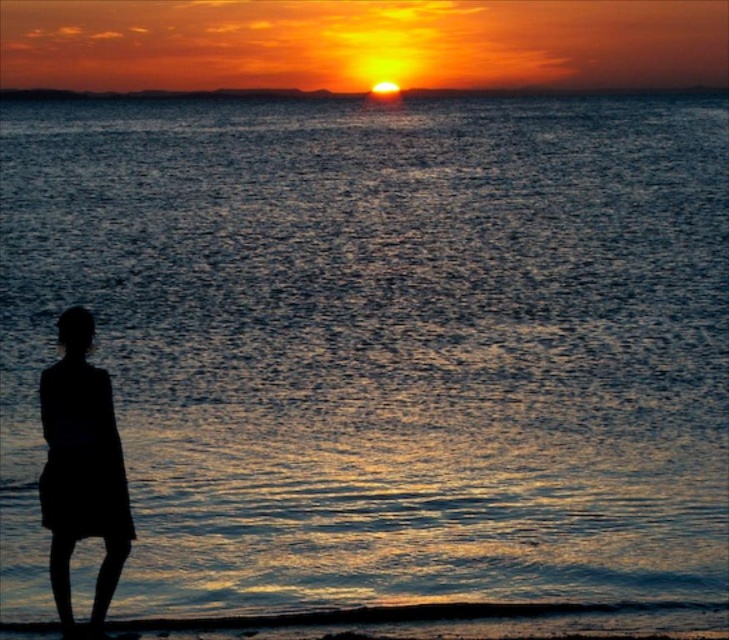
Question: Which of the following is the farthest from the observer?

Choices:
 (A) smooth orange sky at center
 (B) silhouette dress at left

Answer: (A)

Question: Does silhouette dress at left have a lesser width compared to smooth orange sky at center?

Choices:
 (A) no
 (B) yes

Answer: (B)

Question: Does silhouette dress at left have a lesser width compared to smooth orange sky at center?

Choices:
 (A) no
 (B) yes

Answer: (B)

Question: Which of the following is the farthest from the observer?

Choices:
 (A) silhouette dress at left
 (B) smooth orange sky at center

Answer: (B)

Question: Is silhouette dress at left smaller than smooth orange sky at center?

Choices:
 (A) no
 (B) yes

Answer: (B)